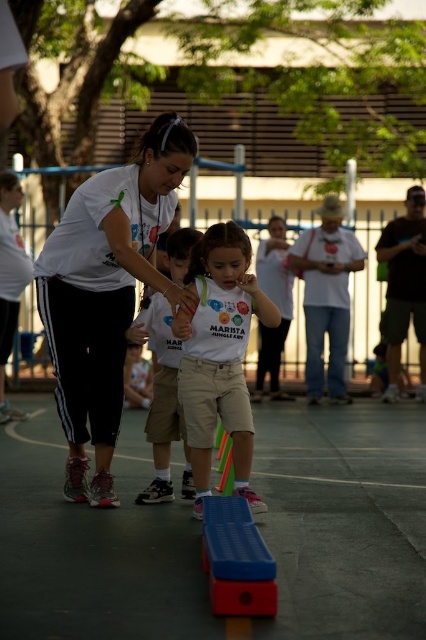
You are a photographer trying to capture the perfect shot of the white cotton shirt at center. You know the shirt is located at coordinates point 0.625, 0.380. If you want to frame the shot so that the shirt is exactly in the center of the photo, where should you position your camera?

The white cotton shirt at center is already positioned at point (x=161, y=400), so to center it in the photo, the camera should be aligned directly at those coordinates.